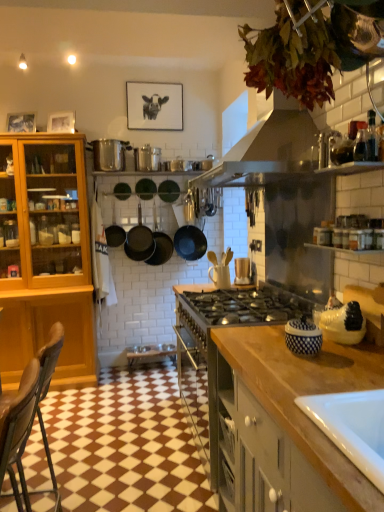
Question: Considering their positions, is matte brown wooden spoon holder at center, the 3th appliance when ordered from top to bottom, located in front of or behind brown leather chair at lower left?

Choices:
 (A) front
 (B) behind

Answer: (B)

Question: From the image's perspective, relative to brown leather chair at lower left, is matte brown wooden spoon holder at center, which is the third appliance from right to left, above or below?

Choices:
 (A) above
 (B) below

Answer: (A)

Question: Which of these objects is positioned closest to the black matte frying pan at center, marked as the 2th frying pan in a right-to-left arrangement?

Choices:
 (A) matte black pans at center, acting as the 2th kitchen appliance starting from the right
 (B) metallic silver pot at upper center, which is the 5th appliance in right-to-left order
 (C) blue and white ceramic jar at right, which appears as the 1th appliance when ordered from the bottom
 (D) brown leather chair at lower left
 (E) black matte picture frame at upper center, positioned as the first picture frame in right-to-left order

Answer: (B)

Question: Which of these objects is positioned closest to the matte wooden picture frame at upper left, the first picture frame when ordered from left to right?

Choices:
 (A) metallic silver pot at upper center, the second appliance from the back
 (B) matte brown wooden spoon holder at center, the 3th appliance when ordered from top to bottom
 (C) matte black pans at center, the second kitchen appliance from the left
 (D) black matte pan at center, which is counted as the 1th kitchen appliance, starting from the right
 (E) shiny metallic pot at center, marked as the fourth appliance in a bottom-to-top arrangement

Answer: (A)